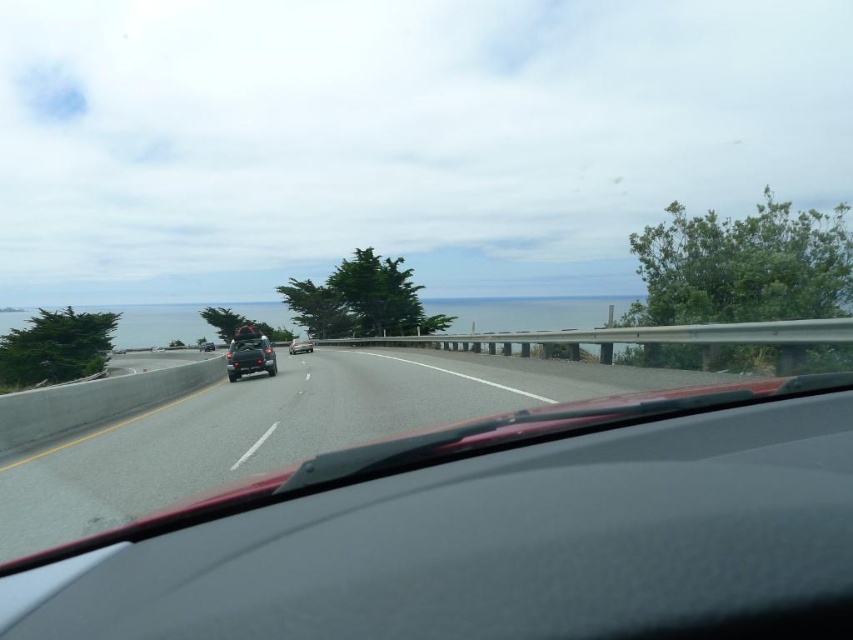
Question: Is asphalt road at center above satin black suv at center?

Choices:
 (A) yes
 (B) no

Answer: (B)

Question: Among these points, which one is nearest to the camera?

Choices:
 (A) (289, 348)
 (B) (264, 348)
 (C) (274, 403)

Answer: (C)

Question: Is asphalt road at center to the left of satin black suv at center from the viewer's perspective?

Choices:
 (A) no
 (B) yes

Answer: (A)

Question: Which point is farther from the camera taking this photo?

Choices:
 (A) (410, 362)
 (B) (291, 349)

Answer: (B)

Question: Does asphalt road at center have a smaller size compared to satin black suv at center?

Choices:
 (A) yes
 (B) no

Answer: (B)

Question: Which object is positioned closest to the satin black suv at center?

Choices:
 (A) satin black car at center
 (B) asphalt road at center

Answer: (B)